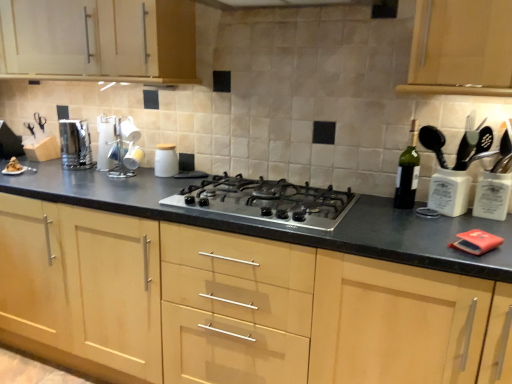
Locate an element on the screen. The height and width of the screenshot is (384, 512). vacant area that lies to the right of green glass bottle at right is located at coordinates (432, 210).